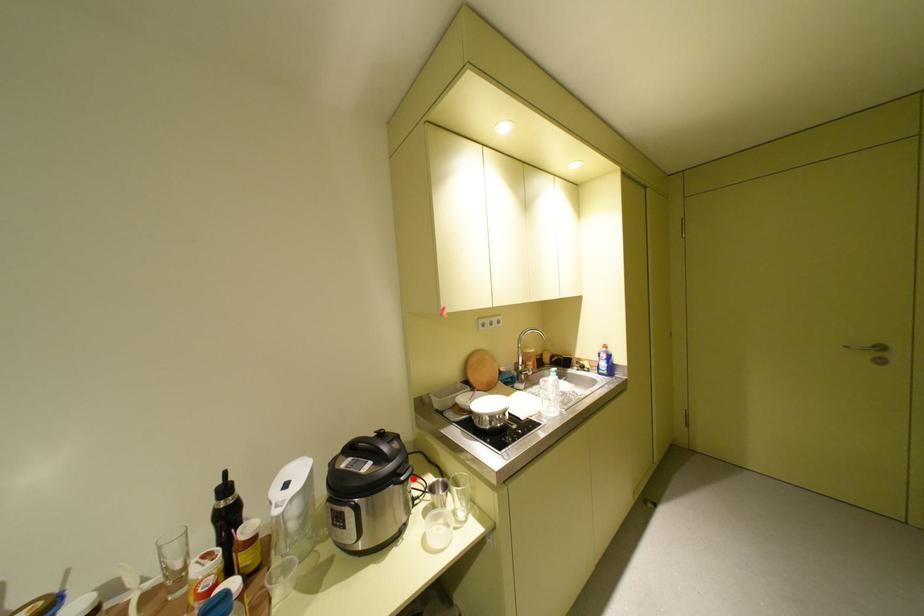
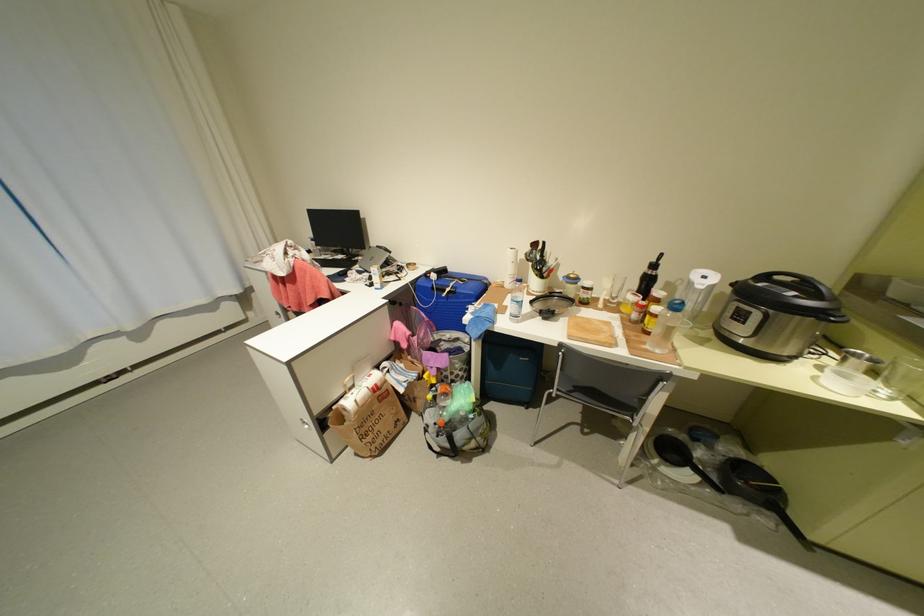
Where in the second image is the point corresponding to the highlighted location from the first image?

(844, 320)